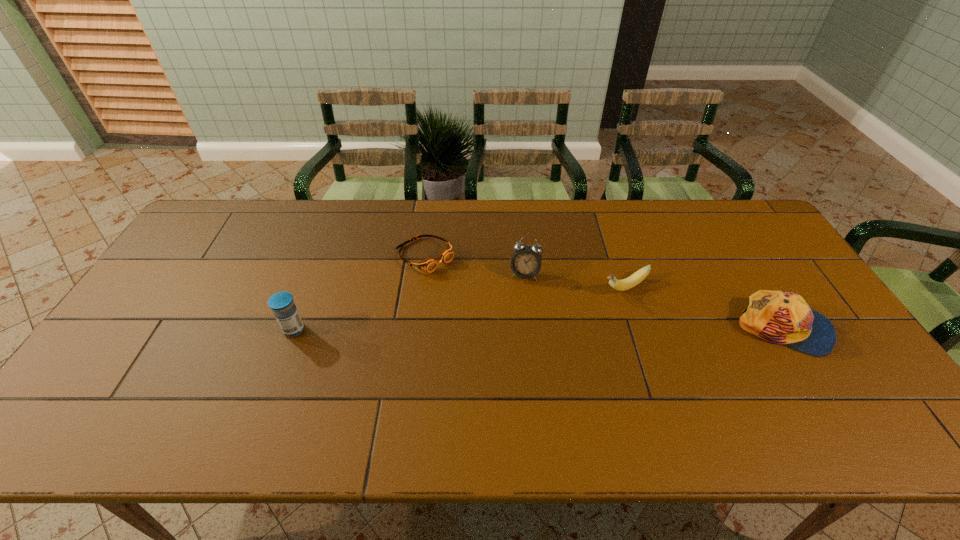
The height and width of the screenshot is (540, 960). I want to click on medicine, so click(x=282, y=304).

Image resolution: width=960 pixels, height=540 pixels. I want to click on cap, so click(x=778, y=317).

What are the coordinates of `the second object from right to left` in the screenshot? It's located at (620, 285).

Identify the location of the third object from right to left. (526, 261).

Find the location of `the second object from left to right`. the second object from left to right is located at coordinates (428, 265).

I want to click on the shortest object, so click(x=428, y=265).

Where is `vacant space located 0.240m on the right of the medicine`? Image resolution: width=960 pixels, height=540 pixels. vacant space located 0.240m on the right of the medicine is located at coordinates [395, 330].

Where is `vacant space located at the stem of the banana`? vacant space located at the stem of the banana is located at coordinates (580, 307).

Find the location of `vacant space located at the stem of the banana`. vacant space located at the stem of the banana is located at coordinates (510, 342).

Image resolution: width=960 pixels, height=540 pixels. In order to click on vacant space located at the stem of the banana in this screenshot , I will do `click(561, 316)`.